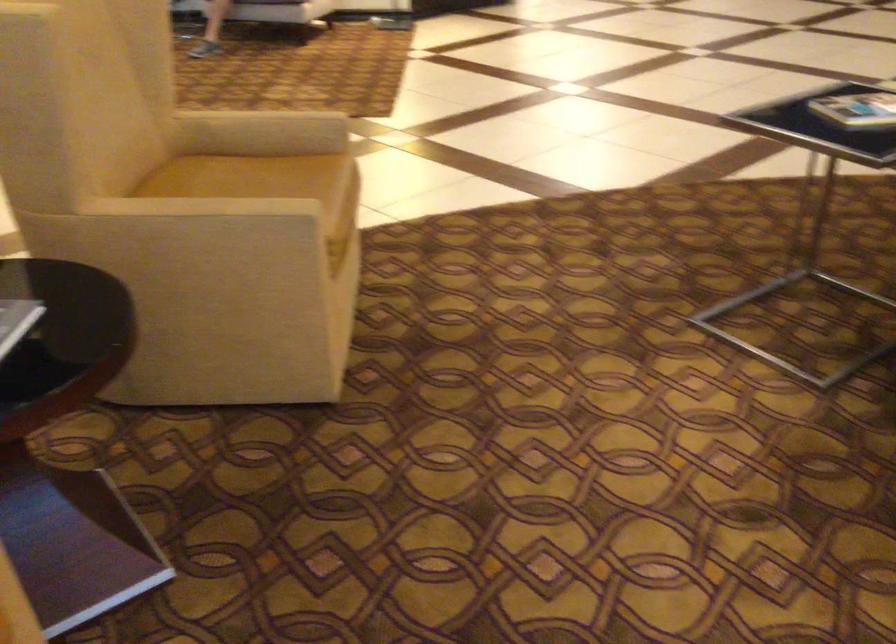
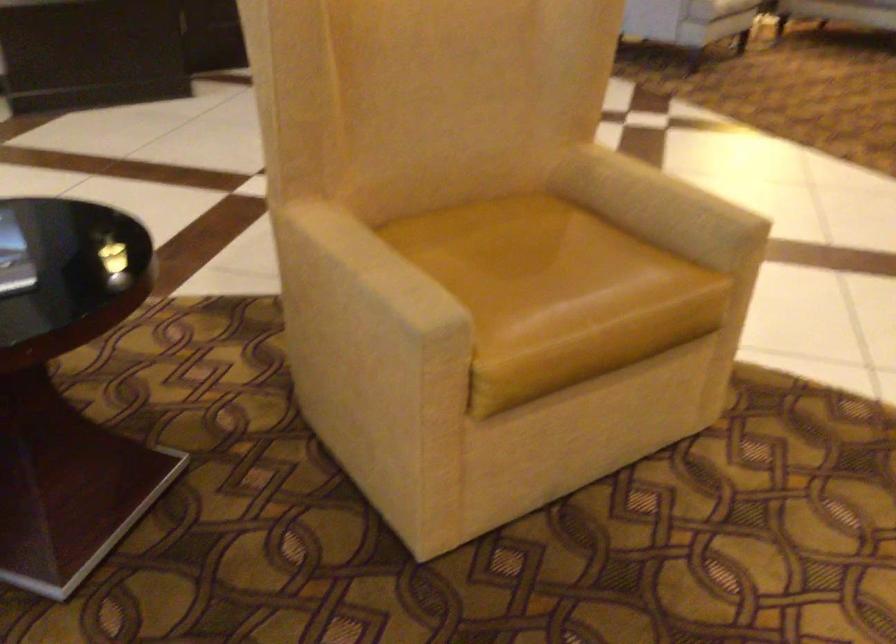
Where in the second image is the point corresponding to point 247,187 from the first image?

(520, 256)